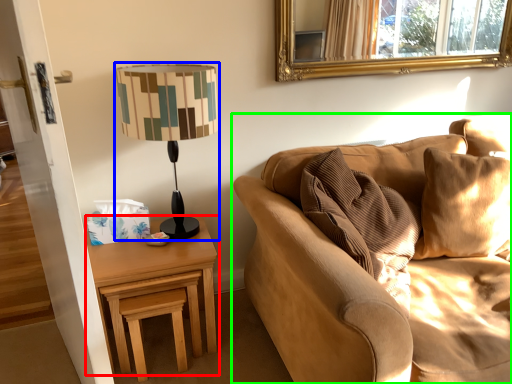
Question: Considering the real-world distances, which object is farthest from nightstand (highlighted by a red box)? lamp (highlighted by a blue box) or studio couch (highlighted by a green box)?

Choices:
 (A) lamp
 (B) studio couch

Answer: (A)